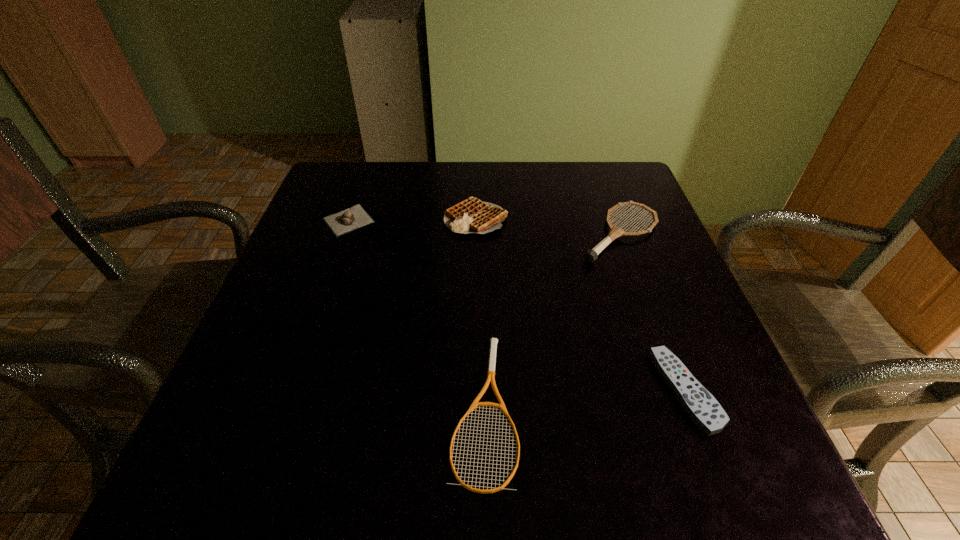
I want to click on vacant region between the waffle and the nearer tennis racket, so click(480, 313).

You are a GUI agent. You are given a task and a screenshot of the screen. Output one action in this format:
    pyautogui.click(x=<x>, y=<y>)
    Task: Click on the vacant space that is in between the waffle and the third shortest object
    
    Given the screenshot: What is the action you would take?
    pyautogui.click(x=413, y=219)

Locate an element on the screen. The image size is (960, 540). vacant area that lies between the waffle and the taller tennis racket is located at coordinates (547, 226).

The width and height of the screenshot is (960, 540). Identify the location of unoccupied position between the third tallest object and the nearer tennis racket. (417, 314).

Find the location of `free space between the taller tennis racket and the waffle`. free space between the taller tennis racket and the waffle is located at coordinates (547, 226).

Locate an element on the screen. The height and width of the screenshot is (540, 960). free area in between the taller tennis racket and the waffle is located at coordinates (547, 226).

Locate an element on the screen. free spot between the waffle and the remote control is located at coordinates (581, 305).

Identify which object is located as the second nearest to the remote control. Please provide its 2D coordinates. Your answer should be formatted as a tuple, i.e. [(x, y)], where the tuple contains the x and y coordinates of a point satisfying the conditions above.

[(493, 341)]

The width and height of the screenshot is (960, 540). I want to click on object that is the fourth nearest to the second shortest object, so click(353, 218).

Where is `free space in the image that satisfies the following two spatial constraints: 1. on the front side of the leftmost object; 2. on the right side of the taller tennis racket`? The image size is (960, 540). free space in the image that satisfies the following two spatial constraints: 1. on the front side of the leftmost object; 2. on the right side of the taller tennis racket is located at coordinates (344, 234).